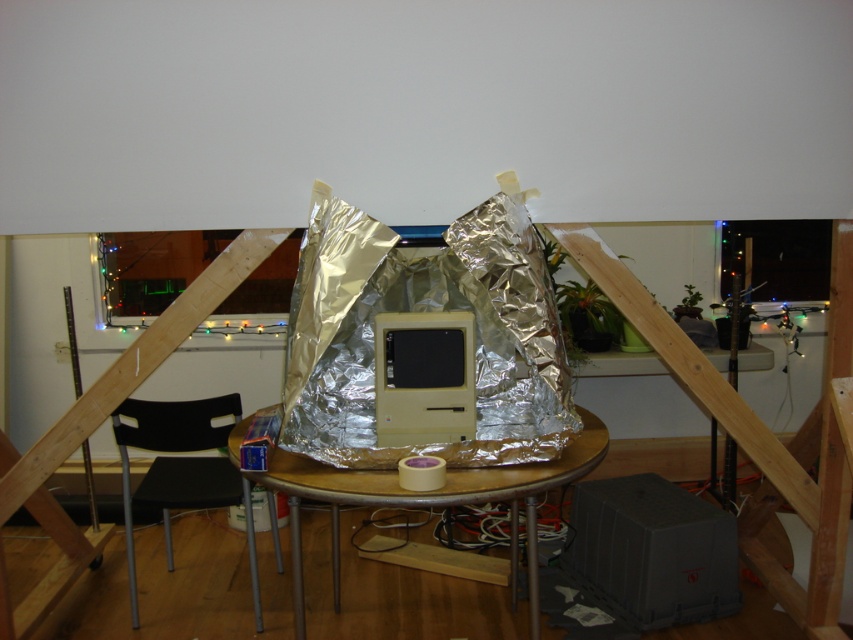
Between matte plastic desktop computer at center and metallic reflective monitor at upper right, which one has less height?

With less height is matte plastic desktop computer at center.

Locate an element on the screen. Image resolution: width=853 pixels, height=640 pixels. matte plastic desktop computer at center is located at coordinates (422, 378).

Does point (421, 396) lie in front of point (727, 259)?

Yes, it is in front of point (727, 259).

Where is `matte plastic desktop computer at center`? matte plastic desktop computer at center is located at coordinates (422, 378).

Is black plastic chair at lower left in front of metallic reflective monitor at upper right?

Yes, it is.

Is black plastic chair at lower left behind metallic reflective monitor at upper right?

No, black plastic chair at lower left is in front of metallic reflective monitor at upper right.

Who is more distant from viewer, (183, 436) or (802, 292)?

Point (802, 292)

Find the location of `black plastic chair at lower left`. black plastic chair at lower left is located at coordinates (181, 468).

Between point (531, 504) and point (155, 460), which one is positioned in front?

Point (531, 504)

Who is more distant from viewer, (247, 474) or (235, 499)?

Positioned behind is point (235, 499).

This screenshot has height=640, width=853. I want to click on wooden table at center, so click(x=419, y=492).